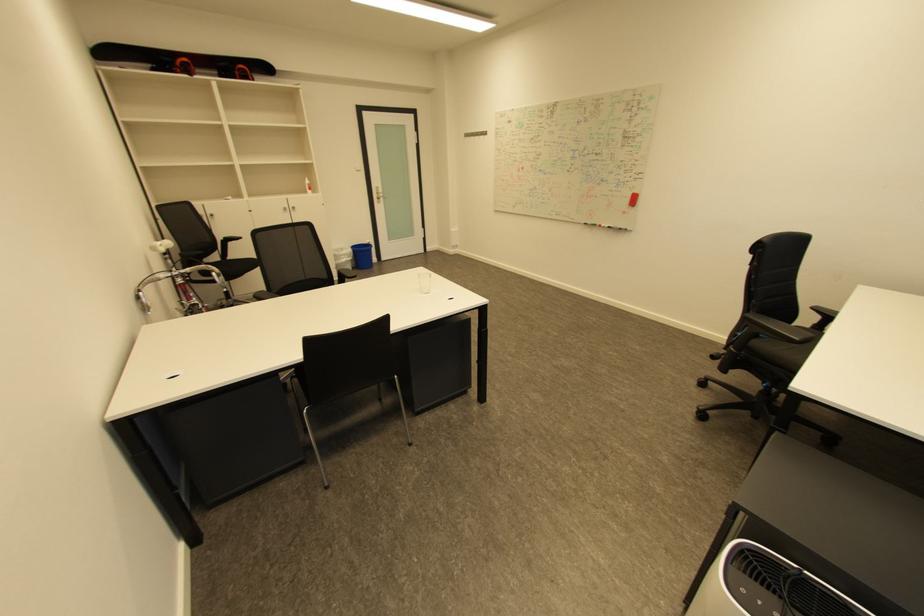
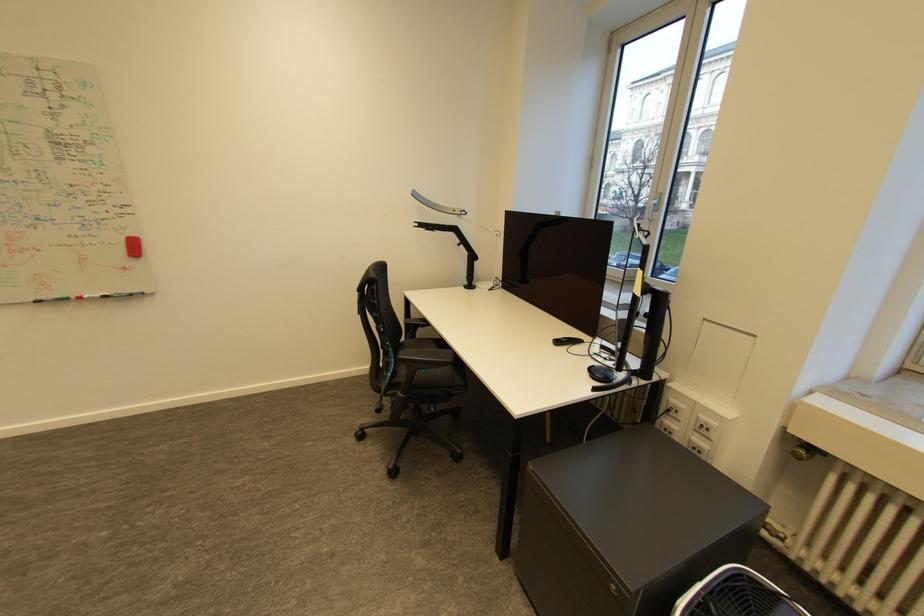
Question: Based on the continuous images, in which direction is the camera rotating? Reply with the corresponding letter.

Choices:
 (A) Left
 (B) Right
 (C) Up
 (D) Down

Answer: (B)